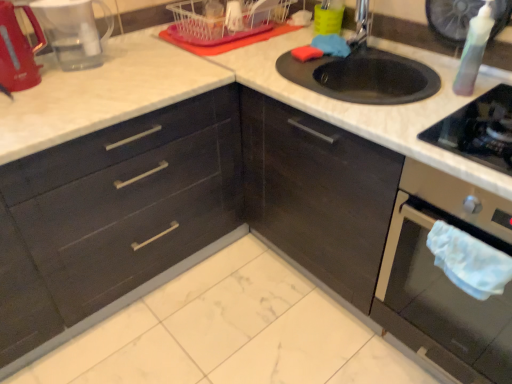
Question: Is metallic silver faucet at upper right facing towards matte black oven at lower right?

Choices:
 (A) yes
 (B) no

Answer: (B)

Question: From a real-world perspective, is metallic silver faucet at upper right physically below matte black oven at lower right?

Choices:
 (A) yes
 (B) no

Answer: (B)

Question: Can you confirm if metallic silver faucet at upper right is smaller than matte black oven at lower right?

Choices:
 (A) no
 (B) yes

Answer: (B)

Question: Does metallic silver faucet at upper right appear on the left side of matte black oven at lower right?

Choices:
 (A) yes
 (B) no

Answer: (A)

Question: Can you confirm if metallic silver faucet at upper right is shorter than matte black oven at lower right?

Choices:
 (A) yes
 (B) no

Answer: (A)

Question: Is metallic red kettle at left, the 1th appliance from the left, bigger or smaller than metallic silver faucet at upper right?

Choices:
 (A) small
 (B) big

Answer: (B)

Question: Considering the positions of metallic red kettle at left, which is the second appliance from right to left, and metallic silver faucet at upper right in the image, is metallic red kettle at left, which is the second appliance from right to left, wider or thinner than metallic silver faucet at upper right?

Choices:
 (A) wide
 (B) thin

Answer: (A)

Question: Does point (5, 76) appear closer or farther from the camera than point (362, 18)?

Choices:
 (A) farther
 (B) closer

Answer: (B)

Question: Is metallic red kettle at left, which is the second appliance from right to left, spatially inside metallic silver faucet at upper right, or outside of it?

Choices:
 (A) inside
 (B) outside

Answer: (B)

Question: From their relative heights in the image, would you say black glass gas stove at right is taller or shorter than transparent plastic bottle at upper right?

Choices:
 (A) tall
 (B) short

Answer: (B)

Question: Would you say black glass gas stove at right is to the left or to the right of transparent plastic bottle at upper right in the picture?

Choices:
 (A) left
 (B) right

Answer: (B)

Question: From the image's perspective, is black glass gas stove at right located above or below transparent plastic bottle at upper right?

Choices:
 (A) below
 (B) above

Answer: (A)

Question: From a real-world perspective, is black glass gas stove at right physically located above or below transparent plastic bottle at upper right?

Choices:
 (A) below
 (B) above

Answer: (A)

Question: Visually, is matte black drawers at left positioned to the left or to the right of red plastic coffee maker at upper left?

Choices:
 (A) left
 (B) right

Answer: (A)

Question: Is point (93, 170) closer or farther from the camera than point (74, 21)?

Choices:
 (A) farther
 (B) closer

Answer: (B)